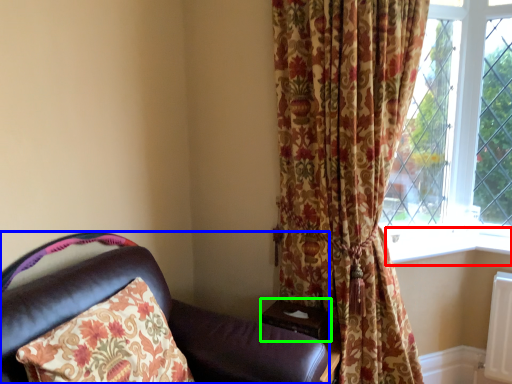
Question: Which object is the farthest from window sill (highlighted by a red box)? Choose among these: chair (highlighted by a blue box) or table (highlighted by a green box).

Choices:
 (A) chair
 (B) table

Answer: (A)